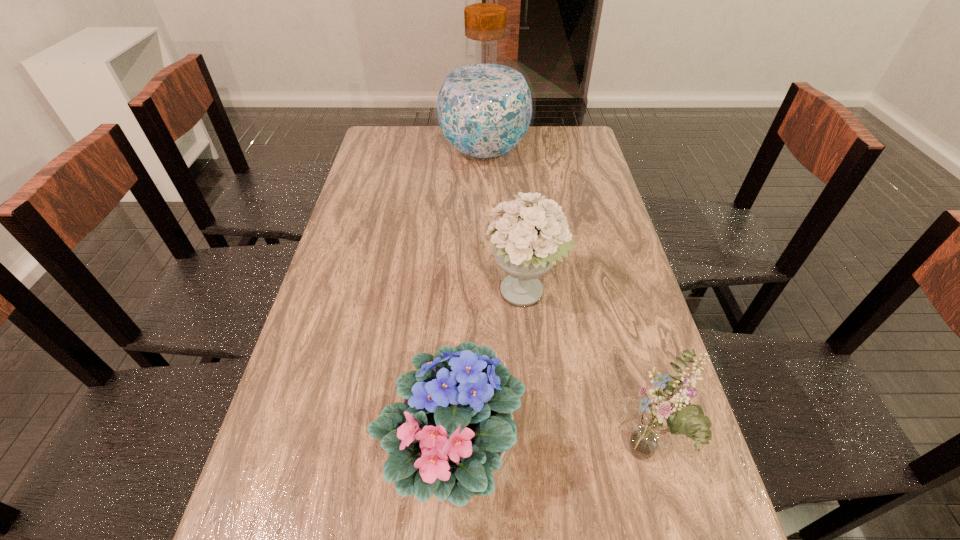
Locate an element on the screen. This screenshot has width=960, height=540. vacant space located on the right of the shortest object is located at coordinates (577, 450).

This screenshot has height=540, width=960. Find the location of `object at the far edge`. object at the far edge is located at coordinates (484, 106).

At what (x,y) coordinates should I click in order to perform the action: click on object located in the right edge section of the desktop. Please return your answer as a coordinate pair (x, y). The image size is (960, 540). Looking at the image, I should click on (650, 431).

The image size is (960, 540). In order to click on vacant area at the far edge in this screenshot , I will do `click(427, 133)`.

In order to click on free point at the left edge in this screenshot , I will do `click(379, 258)`.

Identify the location of free space at the far left corner of the desktop. This screenshot has height=540, width=960. coord(372,156).

The image size is (960, 540). In the image, there is a desktop. Identify the location of vacant space at the far right corner. (553, 126).

Locate an element on the screen. This screenshot has width=960, height=540. vacant space in between the farthest object and the rightmost object is located at coordinates (564, 303).

Locate an element on the screen. The image size is (960, 540). unoccupied position between the rightmost bouquet and the shortest bouquet is located at coordinates (548, 453).

Locate an element on the screen. The width and height of the screenshot is (960, 540). empty space between the tallest object and the rightmost object is located at coordinates (564, 303).